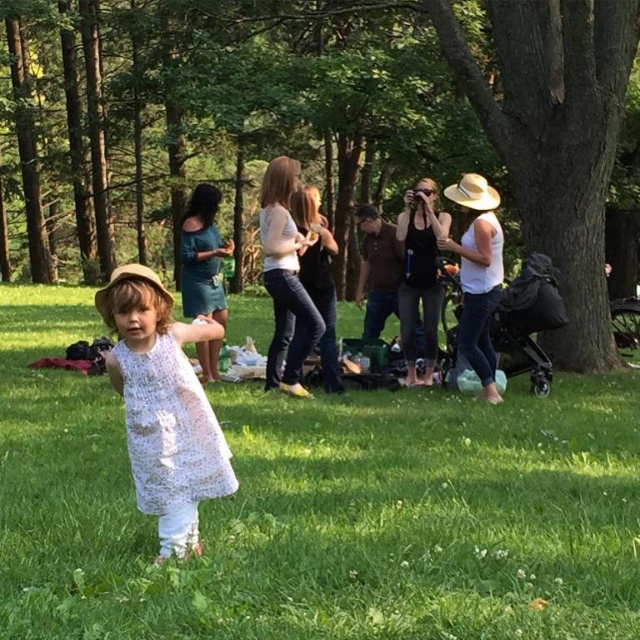
You are a photographer trying to capture the child in the white lace dress at center. Based on the coordinates provided, where should you position your camera to ensure the dress is centered in the frame?

The white lace dress at center is located at coordinates point (170, 429), so positioning the camera to center the frame at those coordinates would ensure the dress is centered.